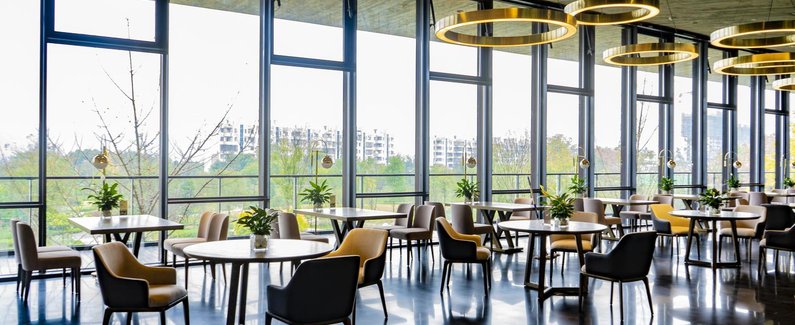
The image size is (795, 325). I want to click on chandeliers, so click(582, 8), click(553, 20), click(621, 48), click(727, 30), click(724, 61), click(782, 82).